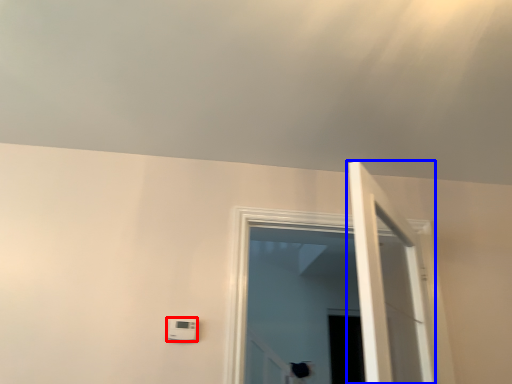
Question: Among these objects, which one is farthest to the camera, light switch (highlighted by a red box) or door (highlighted by a blue box)?

Choices:
 (A) light switch
 (B) door

Answer: (A)